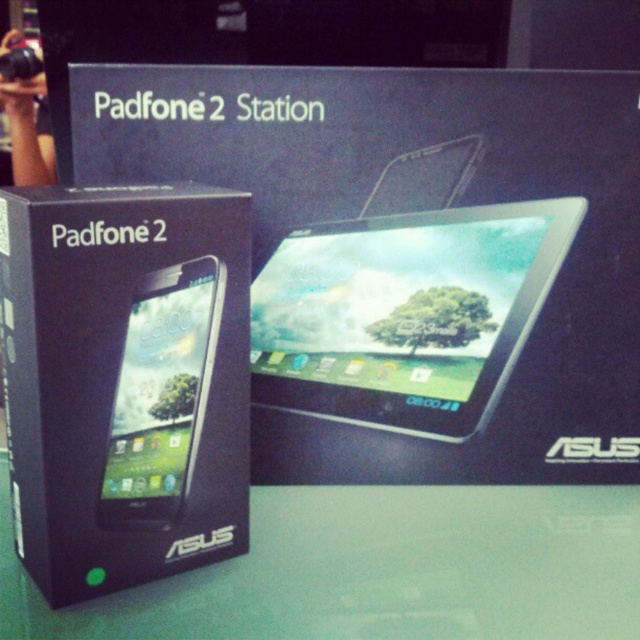
Is matte black tablet at center positioned at the back of matte black smartphone at center?

Yes, it is behind matte black smartphone at center.

Who is more forward, (449, 296) or (179, 486)?

Point (179, 486) is in front.

This screenshot has width=640, height=640. What are the coordinates of `matte black tablet at center` in the screenshot? It's located at (404, 314).

Can you confirm if black matte box at center is shorter than matte black tablet at center?

No.

Does black matte box at center have a smaller size compared to matte black tablet at center?

Incorrect, black matte box at center is not smaller in size than matte black tablet at center.

Between point (17, 227) and point (490, 230), which one is positioned behind?

Point (490, 230)

Find the location of `black matte box at center`. black matte box at center is located at coordinates (124, 381).

Based on the photo, is black matte box at center below matte black smartphone at center?

Actually, black matte box at center is above matte black smartphone at center.

Does black matte box at center appear over matte black smartphone at center?

Correct, black matte box at center is located above matte black smartphone at center.

Identify the location of black matte box at center. (124, 381).